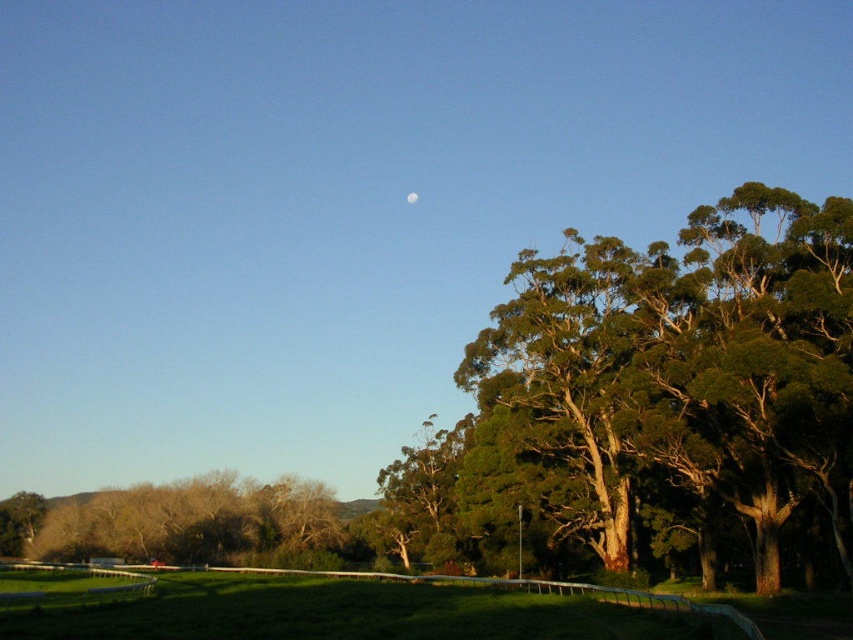
Question: Which point is farther to the camera?

Choices:
 (A) (405, 196)
 (B) (171, 515)
 (C) (560, 356)

Answer: (A)

Question: Which point is closer to the camera taking this photo?

Choices:
 (A) (408, 196)
 (B) (268, 525)
 (C) (502, 484)

Answer: (C)

Question: Can you confirm if green textured tree at upper right is thinner than green leafy tree at lower left?

Choices:
 (A) yes
 (B) no

Answer: (A)

Question: Can you confirm if green textured tree at upper right is smaller than green leafy tree at lower left?

Choices:
 (A) no
 (B) yes

Answer: (A)

Question: Based on their relative distances, which object is nearer to the green leafy tree at lower left?

Choices:
 (A) white glossy moon at upper center
 (B) green textured tree at upper right

Answer: (B)

Question: Is green textured tree at upper right positioned behind green leafy tree at lower left?

Choices:
 (A) no
 (B) yes

Answer: (A)